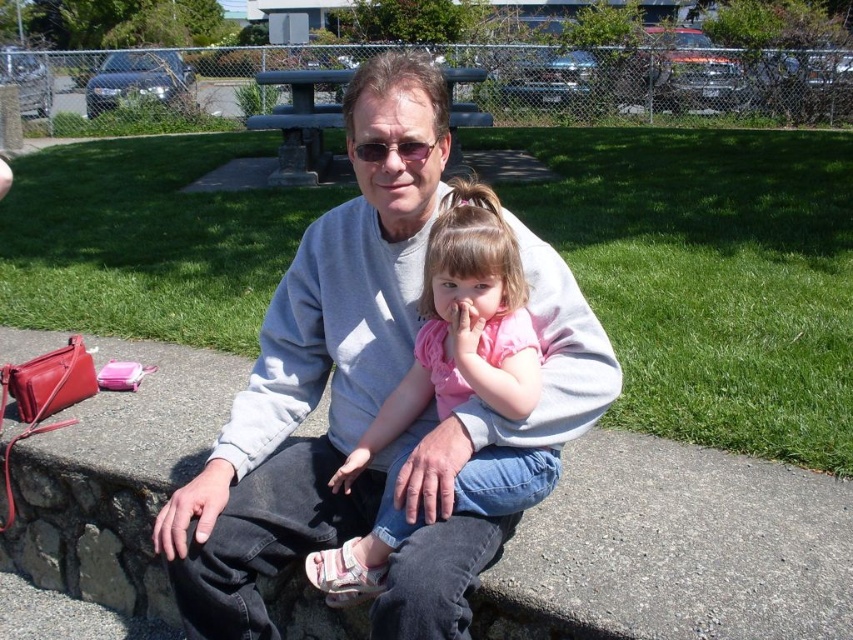
Question: Which object is closer to the camera taking this photo?

Choices:
 (A) green concrete bench at center
 (B) gray sweatshirt at center

Answer: (B)

Question: Is gray sweatshirt at center positioned before green concrete bench at center?

Choices:
 (A) no
 (B) yes

Answer: (B)

Question: Which is nearer to the pink fabric shirt at center?

Choices:
 (A) green concrete bench at center
 (B) gray sweatshirt at center

Answer: (B)

Question: Can you confirm if gray sweatshirt at center is positioned above green concrete bench at center?

Choices:
 (A) no
 (B) yes

Answer: (A)

Question: Estimate the real-world distances between objects in this image. Which object is closer to the gray sweatshirt at center?

Choices:
 (A) pink fabric shirt at center
 (B) green concrete bench at center

Answer: (A)

Question: From the image, what is the correct spatial relationship of gray sweatshirt at center in relation to green concrete bench at center?

Choices:
 (A) below
 (B) above

Answer: (A)